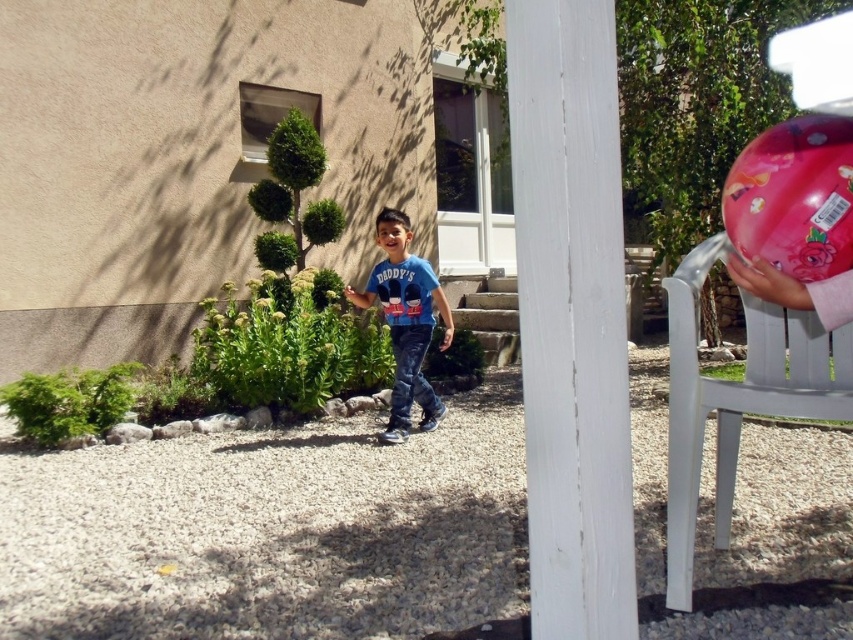
Question: Considering the real-world distances, which object is closest to the shiny pink helmet at upper right?

Choices:
 (A) blue denim jeans at center
 (B) white plastic chair at right

Answer: (B)

Question: Can you confirm if white plastic chair at right is bigger than shiny pink helmet at upper right?

Choices:
 (A) yes
 (B) no

Answer: (A)

Question: Which is nearer to the white plastic chair at right?

Choices:
 (A) blue denim jeans at center
 (B) shiny pink helmet at upper right

Answer: (B)

Question: Is white plastic chair at right positioned before shiny pink helmet at upper right?

Choices:
 (A) yes
 (B) no

Answer: (B)

Question: Can you confirm if shiny pink helmet at upper right is positioned above blue denim jeans at center?

Choices:
 (A) yes
 (B) no

Answer: (A)

Question: Which object appears farthest from the camera in this image?

Choices:
 (A) shiny pink helmet at upper right
 (B) white plastic chair at right
 (C) blue denim jeans at center

Answer: (C)